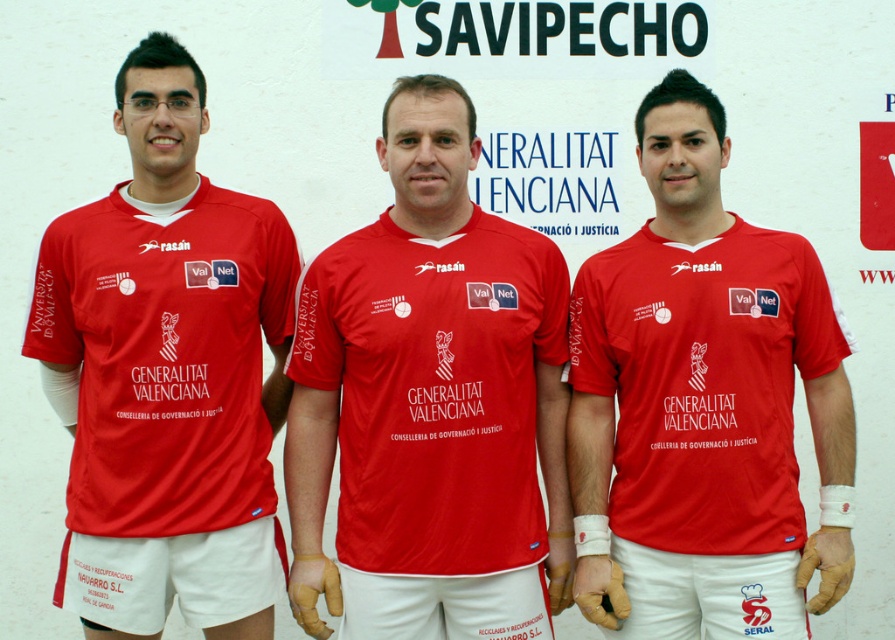
Question: Is the position of matte red shirt at center more distant than that of matte red jersey at left?

Choices:
 (A) no
 (B) yes

Answer: (A)

Question: Which object appears farthest from the camera in this image?

Choices:
 (A) matte jersey at center
 (B) matte red jersey at left
 (C) matte red shirt at center

Answer: (B)

Question: Estimate the real-world distances between objects in this image. Which object is farther from the matte red shirt at center?

Choices:
 (A) matte jersey at center
 (B) matte red jersey at left

Answer: (B)

Question: Which object appears closest to the camera in this image?

Choices:
 (A) matte red shirt at center
 (B) matte red jersey at left

Answer: (A)

Question: Is matte jersey at center below matte red jersey at left?

Choices:
 (A) no
 (B) yes

Answer: (B)

Question: Does matte jersey at center have a larger size compared to matte red jersey at left?

Choices:
 (A) yes
 (B) no

Answer: (B)